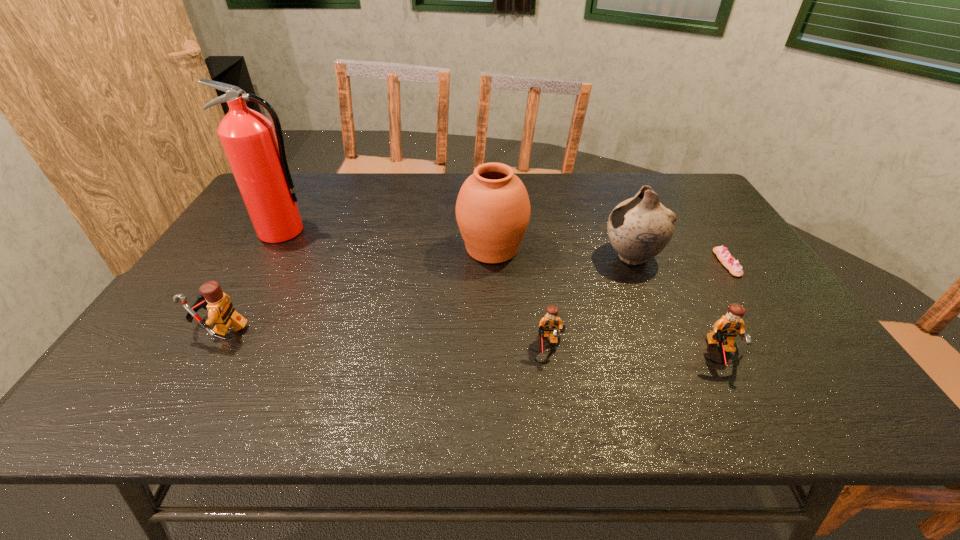
The height and width of the screenshot is (540, 960). What are the coordinates of `vacant area that lies between the shortest object and the pottery` in the screenshot? It's located at pos(680,260).

Identify the location of empty space that is in between the tallest Lego and the fire extinguisher. The width and height of the screenshot is (960, 540). (252, 280).

The width and height of the screenshot is (960, 540). In order to click on blank region between the pottery and the rightmost Lego in this screenshot , I will do `click(675, 306)`.

The height and width of the screenshot is (540, 960). I want to click on empty space that is in between the urn and the fifth tallest object, so click(x=606, y=302).

In order to click on unoccupied area between the rightmost Lego and the eclair in this screenshot , I will do `click(723, 309)`.

Locate an element on the screen. This screenshot has height=540, width=960. object that is the closest to the rightmost Lego is located at coordinates (639, 228).

Find the location of a particular element. This screenshot has width=960, height=540. object that is the second closest one to the pottery is located at coordinates (493, 210).

Image resolution: width=960 pixels, height=540 pixels. I want to click on the second closest Lego to the fifth tallest object, so click(221, 312).

Identify the location of Lego object that ranks as the second closest to the tallest object. This screenshot has height=540, width=960. (549, 323).

Where is `free space that satisfies the following two spatial constraints: 1. on the front side of the urn; 2. holding a crossbow in the hands of the tallest Lego`? Image resolution: width=960 pixels, height=540 pixels. free space that satisfies the following two spatial constraints: 1. on the front side of the urn; 2. holding a crossbow in the hands of the tallest Lego is located at coordinates (494, 328).